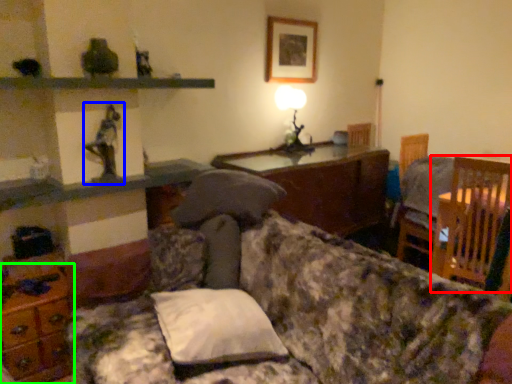
Question: Based on their relative distances, which object is nearer to chair (highlighted by a red box)? Choose from toy (highlighted by a blue box) and dresser (highlighted by a green box).

Choices:
 (A) toy
 (B) dresser

Answer: (A)